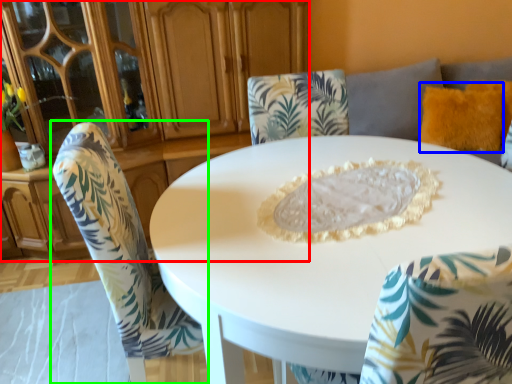
Question: Which object is the farthest from dresser (highlighted by a red box)? Choose among these: pillow (highlighted by a blue box) or chair (highlighted by a green box).

Choices:
 (A) pillow
 (B) chair

Answer: (A)